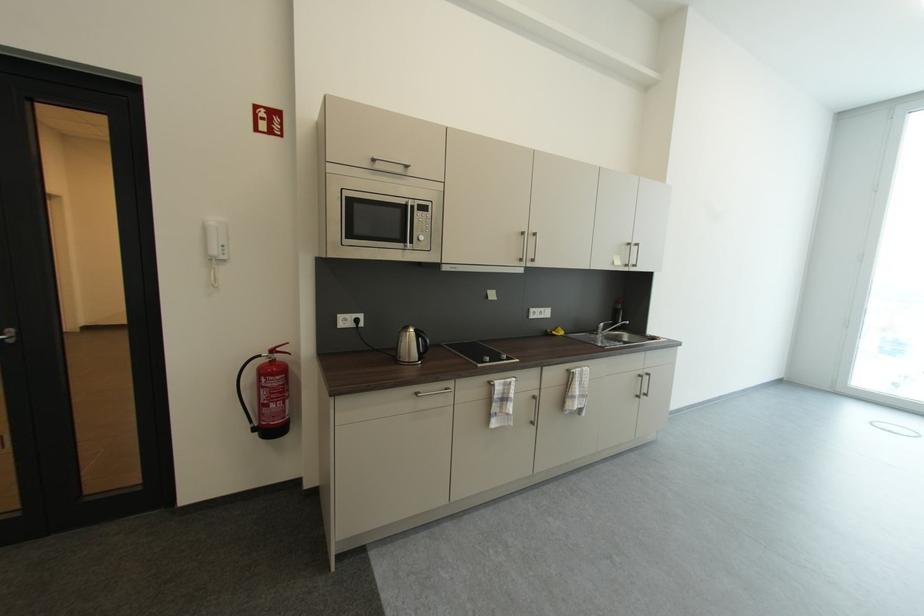
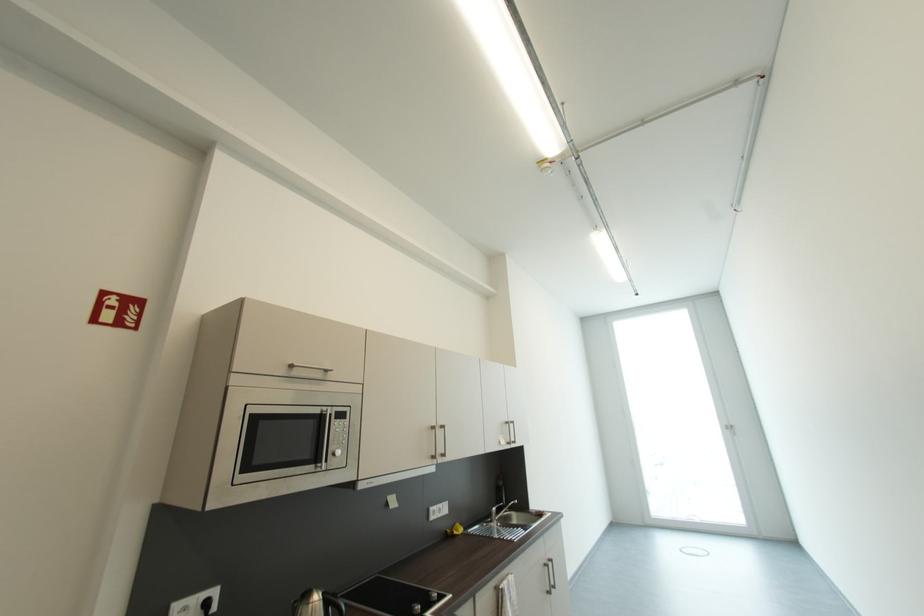
The first image is from the beginning of the video and the second image is from the end. How did the camera likely rotate when shooting the video?

The camera's rotation is toward right-up.